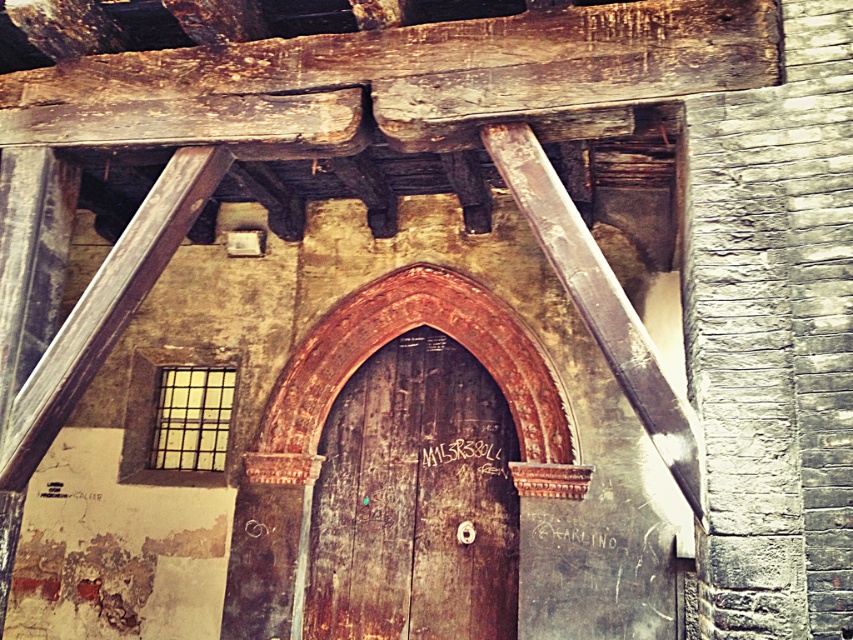
You are standing in front of the old building shown in the image. You need to locate the rusty wood door at center. What are the coordinates where you should look to find it?

The coordinates to locate the rusty wood door at center are at point (415, 500).

You are an architect inspecting the old building. You notice the wooden beam at left and the rusty metal beam at upper center. Which beam has a larger size?

The rusty metal beam at upper center is larger than the wooden beam at left.